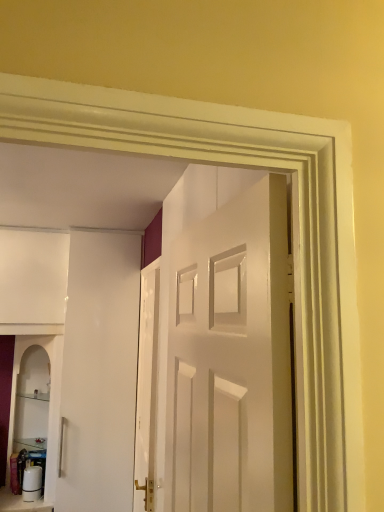
Question: Is white glossy door at center, which is the 1th door from front to back, located outside white glossy door at center, positioned as the 2th door in front-to-back order?

Choices:
 (A) no
 (B) yes

Answer: (B)

Question: Is white glossy door at center, which is the 1th door from front to back, behind white glossy door at center, acting as the 2th door starting from the right?

Choices:
 (A) yes
 (B) no

Answer: (B)

Question: Is white glossy door at center, positioned as the first door in right-to-left order, thinner than white glossy door at center, positioned as the 2th door in front-to-back order?

Choices:
 (A) yes
 (B) no

Answer: (B)

Question: Is white glossy door at center, positioned as the second door in left-to-right order, turned away from white glossy door at center, the 1th door viewed from the left?

Choices:
 (A) no
 (B) yes

Answer: (A)

Question: Is white glossy door at center, positioned as the second door in left-to-right order, to the right of white glossy door at center, positioned as the 2th door in front-to-back order, from the viewer's perspective?

Choices:
 (A) yes
 (B) no

Answer: (A)

Question: Can you confirm if white glossy door at center, the second door in the back-to-front sequence, is taller than white glossy door at center, which appears as the 1th door when viewed from the back?

Choices:
 (A) yes
 (B) no

Answer: (B)

Question: Considering the relative sizes of white glossy door at center, the second door in the back-to-front sequence, and white glossy cabinet at lower left in the image provided, is white glossy door at center, the second door in the back-to-front sequence, shorter than white glossy cabinet at lower left?

Choices:
 (A) no
 (B) yes

Answer: (A)

Question: Is white glossy door at center, positioned as the second door in left-to-right order, surrounding white glossy cabinet at lower left?

Choices:
 (A) no
 (B) yes

Answer: (A)

Question: From the image's perspective, does white glossy door at center, which is the 1th door from front to back, appear higher than white glossy cabinet at lower left?

Choices:
 (A) yes
 (B) no

Answer: (A)

Question: Does white glossy door at center, positioned as the second door in left-to-right order, have a smaller size compared to white glossy cabinet at lower left?

Choices:
 (A) no
 (B) yes

Answer: (A)

Question: Is white glossy door at center, the second door in the back-to-front sequence, taller than white glossy cabinet at lower left?

Choices:
 (A) no
 (B) yes

Answer: (B)

Question: Considering the relative positions of white glossy door at center, positioned as the first door in right-to-left order, and white glossy cabinet at lower left in the image provided, is white glossy door at center, positioned as the first door in right-to-left order, to the right of white glossy cabinet at lower left from the viewer's perspective?

Choices:
 (A) yes
 (B) no

Answer: (A)

Question: Is white glossy door at center, acting as the 2th door starting from the right, to the right of white glossy cabinet at lower left from the viewer's perspective?

Choices:
 (A) yes
 (B) no

Answer: (A)